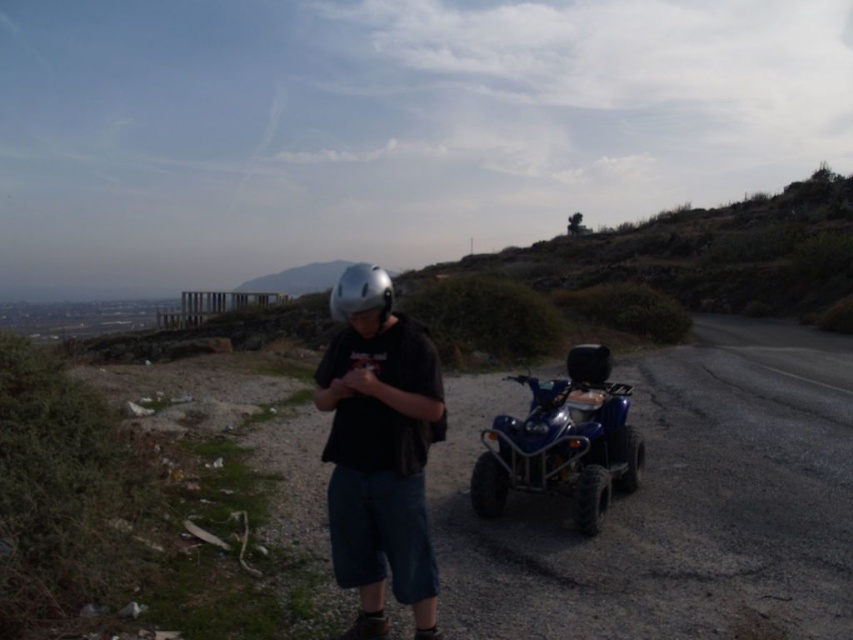
Question: Does blue matte quad bike at right appear on the right side of silver metallic helmet at center?

Choices:
 (A) yes
 (B) no

Answer: (A)

Question: Is matte black helmet at center to the right of blue matte quad bike at right from the viewer's perspective?

Choices:
 (A) yes
 (B) no

Answer: (B)

Question: Which object is positioned farthest from the blue matte quad bike at right?

Choices:
 (A) silver metallic helmet at center
 (B) matte black helmet at center

Answer: (B)

Question: Does blue matte quad bike at right lie in front of silver metallic helmet at center?

Choices:
 (A) yes
 (B) no

Answer: (B)

Question: Which point appears closest to the camera in this image?

Choices:
 (A) (380, 292)
 (B) (598, 451)
 (C) (407, 342)

Answer: (A)

Question: Which point appears closest to the camera in this image?

Choices:
 (A) (596, 412)
 (B) (349, 292)
 (C) (360, 442)

Answer: (B)